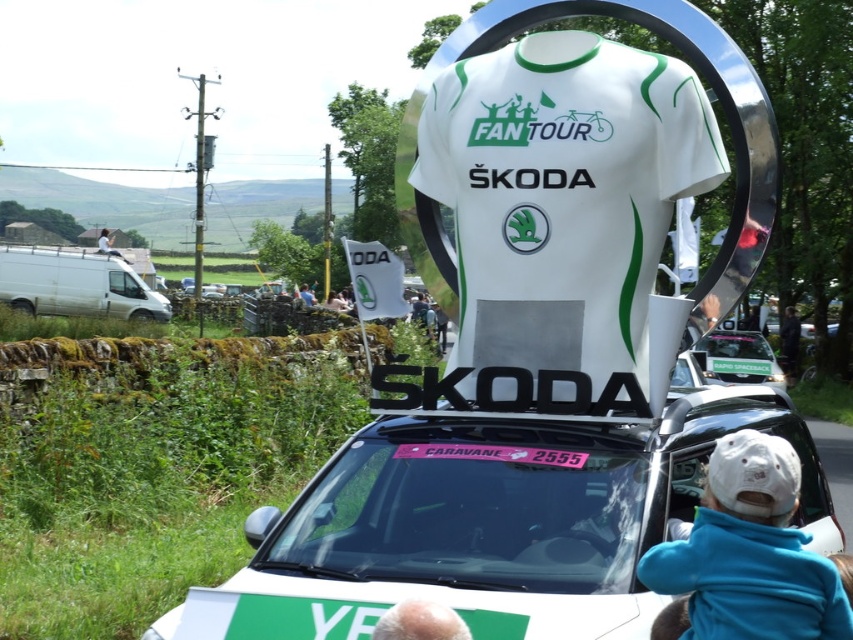
You are standing in front of the car with the white and green cycling jersey. There are two points marked on the car, one at coordinate point (x=277, y=531) and the other at point (x=780, y=605). Which point is closer to you?

Point (x=277, y=531) is further to the camera than point (x=780, y=605). Therefore, point (x=780, y=605) is closer to you.